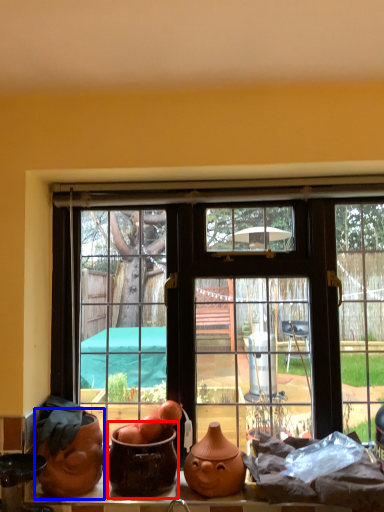
Question: Which object appears farthest to the camera in this image, pottery (highlighted by a red box) or pottery (highlighted by a blue box)?

Choices:
 (A) pottery
 (B) pottery

Answer: (B)